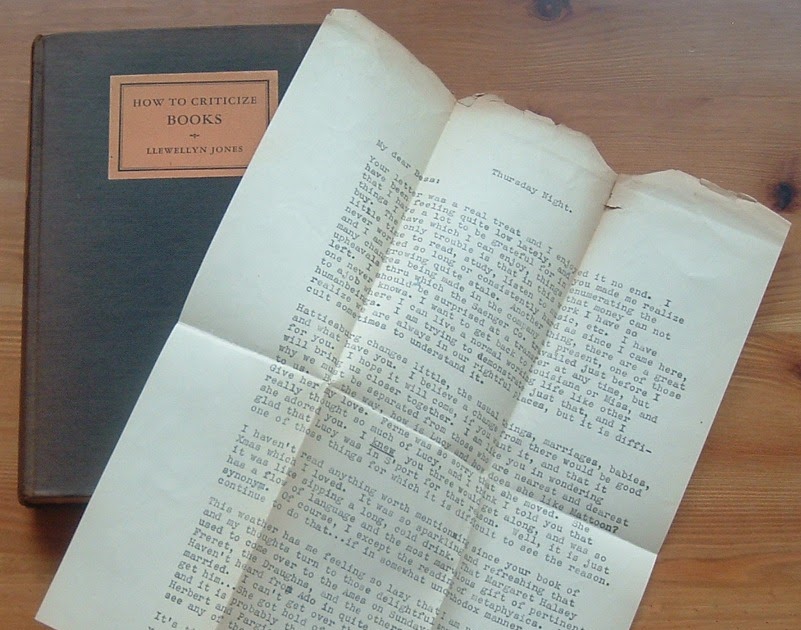
Where is `book spine`? This screenshot has height=630, width=801. book spine is located at coordinates (29, 151).